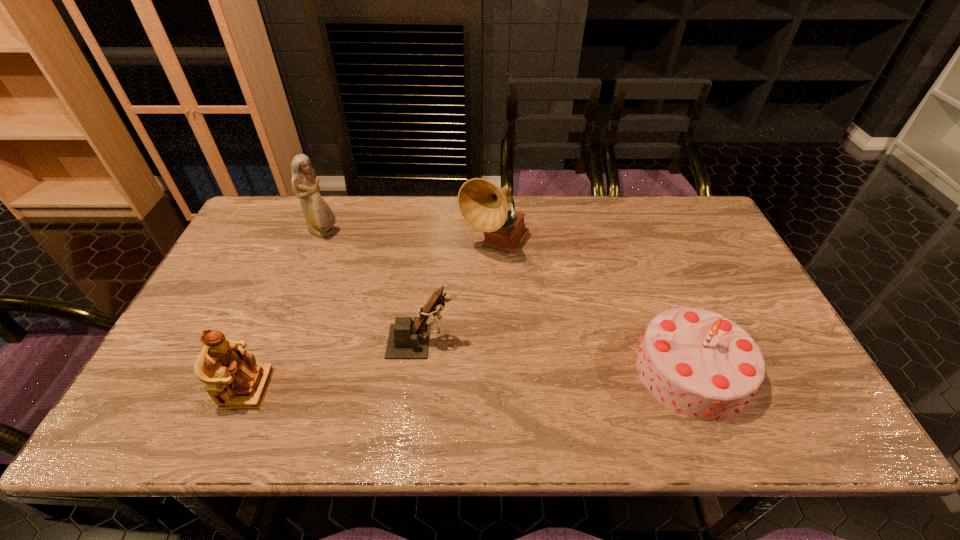
I want to click on vacant space at the far right corner of the desktop, so click(x=695, y=204).

This screenshot has width=960, height=540. Identify the location of blank region between the nearest figurine and the second nearest figurine. (335, 365).

This screenshot has height=540, width=960. I want to click on vacant point located between the rightmost object and the farthest figurine, so click(508, 302).

At what (x,y) coordinates should I click in order to perform the action: click on vacant space in between the phonograph record and the nearest figurine. Please return your answer as a coordinate pair (x, y). Looking at the image, I should click on [x=372, y=317].

Identify the location of free space between the rightmost object and the phonograph record. (593, 308).

Where is `free spot between the phonograph record and the nearest figurine`? free spot between the phonograph record and the nearest figurine is located at coordinates (372, 317).

The width and height of the screenshot is (960, 540). I want to click on vacant space that's between the phonograph record and the rightmost figurine, so click(458, 294).

Where is `free point between the second farthest figurine and the phonograph record`? This screenshot has height=540, width=960. free point between the second farthest figurine and the phonograph record is located at coordinates (458, 294).

This screenshot has width=960, height=540. I want to click on free space between the phonograph record and the rightmost object, so click(593, 308).

The image size is (960, 540). What are the coordinates of `free spot between the birthday cake and the nearest figurine` in the screenshot? It's located at (469, 380).